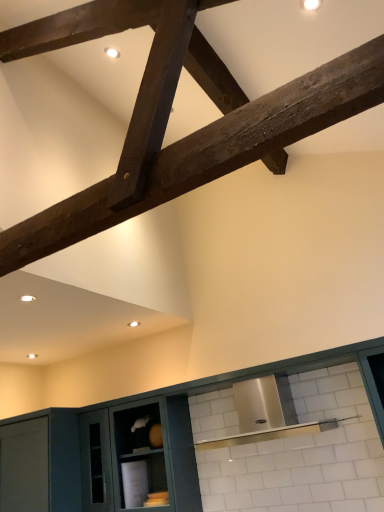
Question: From the image's perspective, is dark brown wood beam at upper center located above matte green cabinetry at center?

Choices:
 (A) no
 (B) yes

Answer: (B)

Question: From the image's perspective, would you say dark brown wood beam at upper center is shown under matte green cabinetry at center?

Choices:
 (A) no
 (B) yes

Answer: (A)

Question: Considering the relative positions of dark brown wood beam at upper center and matte green cabinetry at center in the image provided, is dark brown wood beam at upper center in front of matte green cabinetry at center?

Choices:
 (A) yes
 (B) no

Answer: (A)

Question: Are dark brown wood beam at upper center and matte green cabinetry at center beside each other?

Choices:
 (A) yes
 (B) no

Answer: (B)

Question: Is dark brown wood beam at upper center bigger than matte green cabinetry at center?

Choices:
 (A) yes
 (B) no

Answer: (B)

Question: From a real-world perspective, is dark brown wood beam at upper center physically below matte green cabinetry at center?

Choices:
 (A) no
 (B) yes

Answer: (A)

Question: Can you confirm if matte green cabinetry at center is wider than dark brown wood beam at upper center?

Choices:
 (A) yes
 (B) no

Answer: (B)

Question: Would you consider matte green cabinetry at center to be distant from dark brown wood beam at upper center?

Choices:
 (A) yes
 (B) no

Answer: (A)

Question: Can you confirm if matte green cabinetry at center is smaller than dark brown wood beam at upper center?

Choices:
 (A) no
 (B) yes

Answer: (A)

Question: From the image's perspective, is matte green cabinetry at center below dark brown wood beam at upper center?

Choices:
 (A) yes
 (B) no

Answer: (A)

Question: Can dark brown wood beam at upper center be found inside matte green cabinetry at center?

Choices:
 (A) no
 (B) yes

Answer: (A)

Question: Is matte green cabinetry at center next to dark brown wood beam at upper center and touching it?

Choices:
 (A) yes
 (B) no

Answer: (B)

Question: Does point (18, 485) appear closer or farther from the camera than point (102, 185)?

Choices:
 (A) farther
 (B) closer

Answer: (A)